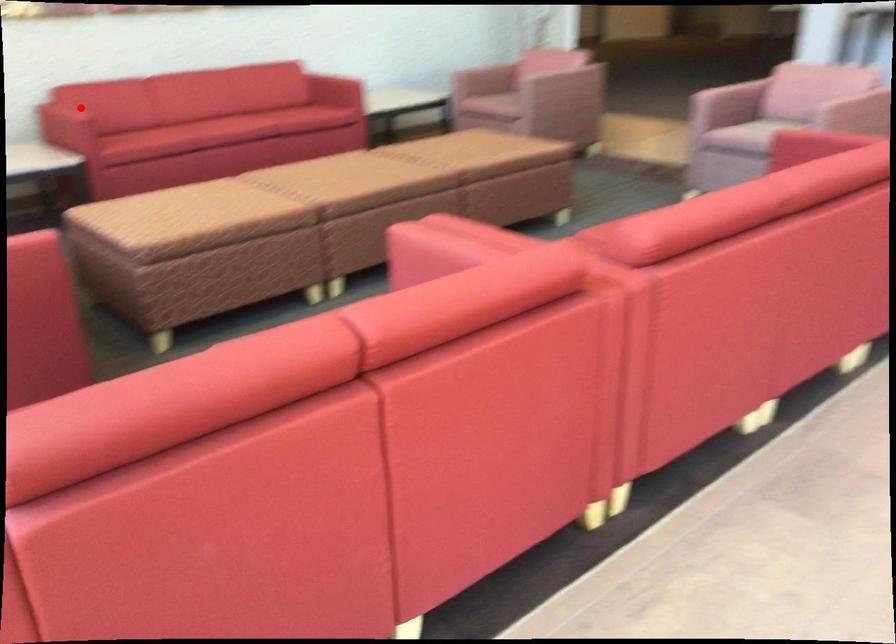
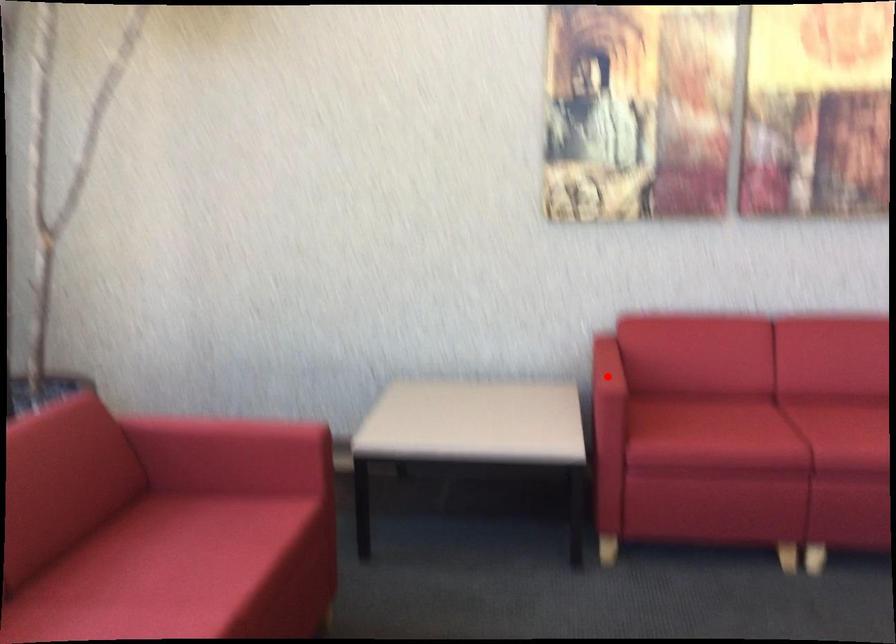
I am providing you with two images of the same scene from different viewpoints. A red point is marked on the first image and another point is marked on the second image. Is the red point in image1 aligned with the point shown in image2?

Yes